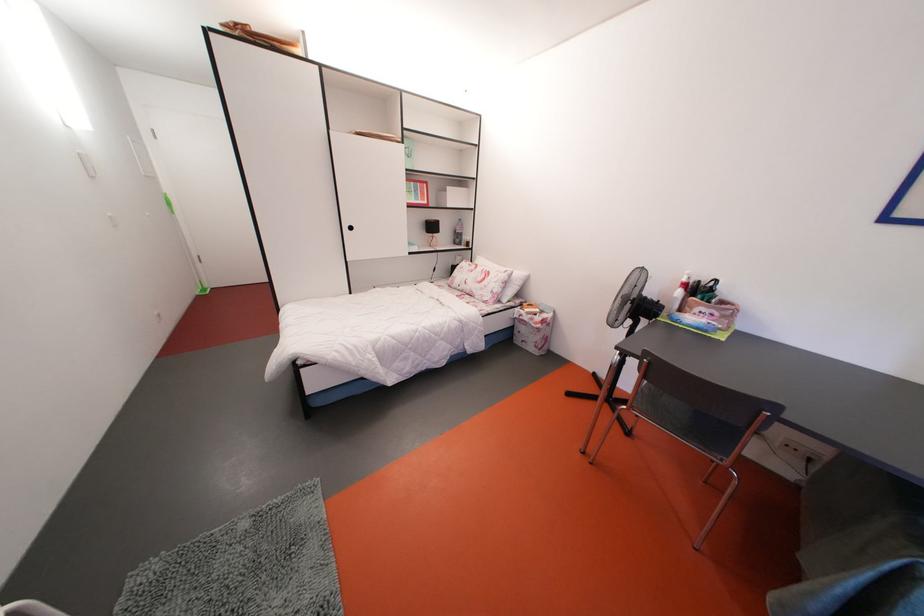
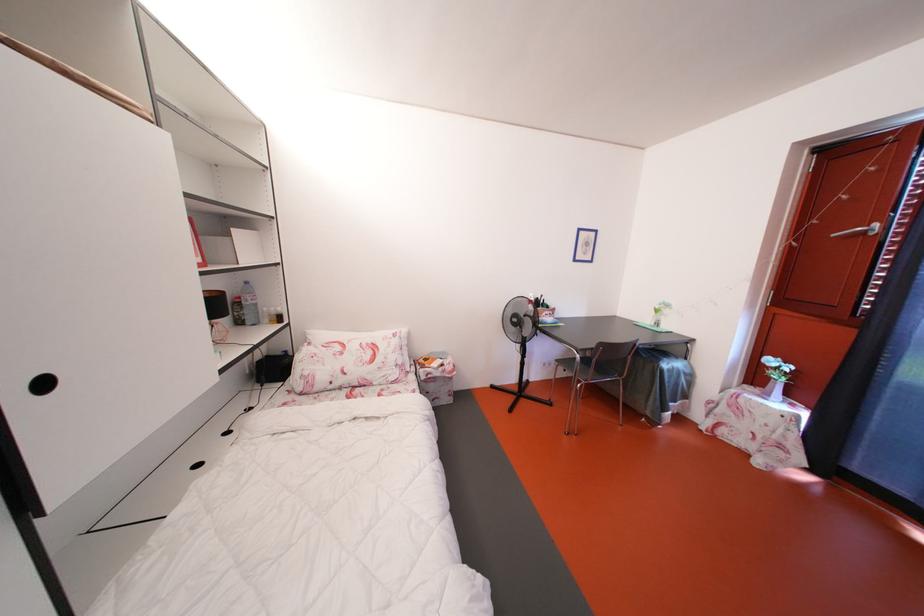
Question: I am providing you with two images of the same scene from different viewpoints. After the viewpoint changes to image2, which objects are now occluded?

Choices:
 (A) small trash can
 (B) chair sitting surface
 (C) white flower vase
 (D) none of these

Answer: (D)